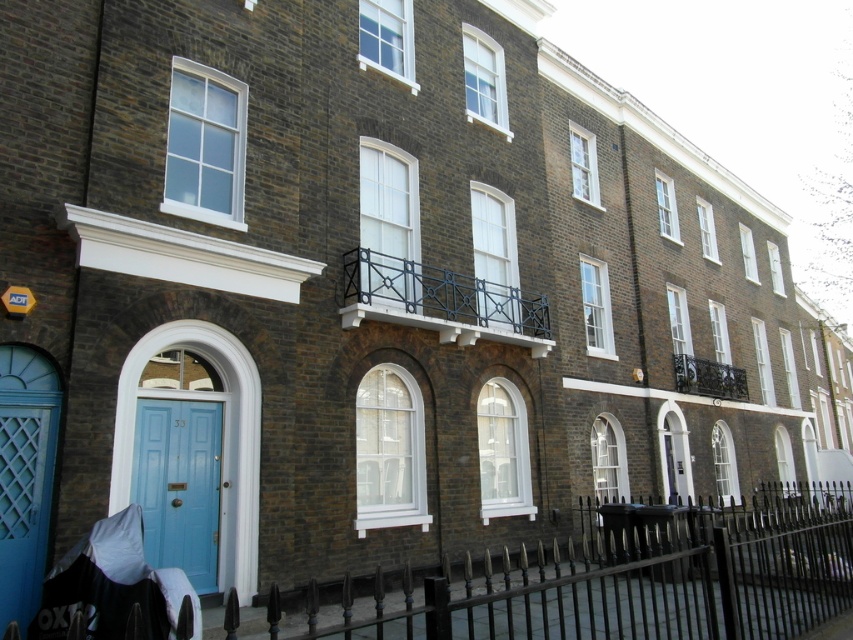
You are a delivery person trying to reach the matte blue door at left. There is a black wrought iron fence at lower center blocking your path. Can you walk through the fence to reach the door?

The black wrought iron fence at lower center has a larger size compared to matte blue door at left, so the fence may have gaps large enough for you to walk through to reach the matte blue door at left.

You are a delivery person approaching the building and need to reach the matte blue door at left. There is a black wrought iron fence at lower center in your path. Can you walk through the fence to reach the door?

The black wrought iron fence at lower center is closer to the viewer than the matte blue door at left, so you can walk through the fence to reach the matte blue door at left as it is in front of the door.

You are a delivery person with a package that requires a 5.5 feet wide pathway to maneuver. You are standing in front of the matte blue door at left and need to reach the black fabric baby carriage at lower left. Is the space between them wide enough for your delivery vehicle?

The distance between the matte blue door at left and the black fabric baby carriage at lower left is 6.20 feet, which is wider than the required 5.5 feet. Therefore, the delivery vehicle can maneuver through the space.